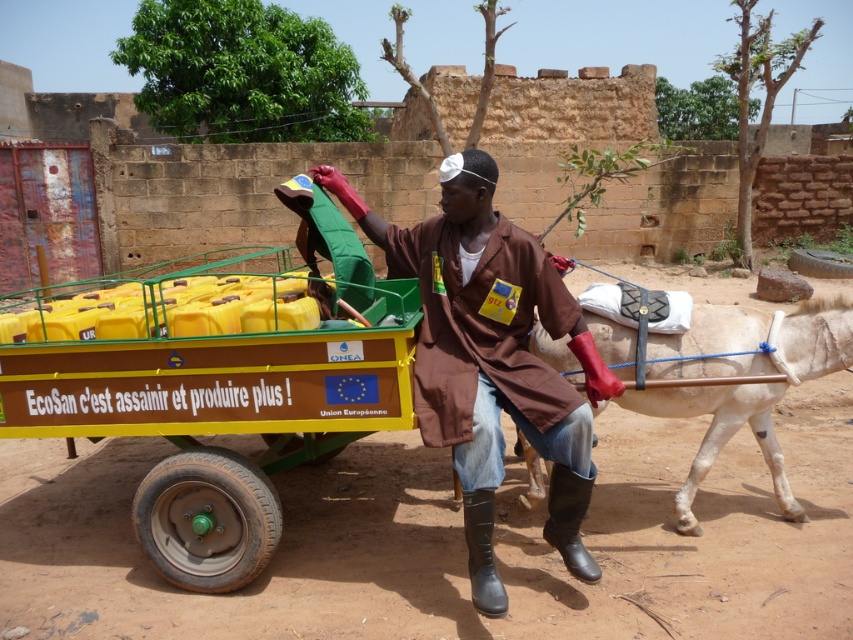
Question: Which object appears closest to the camera in this image?

Choices:
 (A) white smooth mule at lower right
 (B) brown fabric coat at center

Answer: (B)

Question: Does brown fabric coat at center appear on the right side of white smooth mule at lower right?

Choices:
 (A) no
 (B) yes

Answer: (A)

Question: Is brown fabric coat at center closer to the viewer compared to white smooth mule at lower right?

Choices:
 (A) yes
 (B) no

Answer: (A)

Question: Which of the following is the farthest from the observer?

Choices:
 (A) (483, 577)
 (B) (757, 397)

Answer: (B)

Question: Is brown fabric coat at center to the right of white smooth mule at lower right from the viewer's perspective?

Choices:
 (A) yes
 (B) no

Answer: (B)